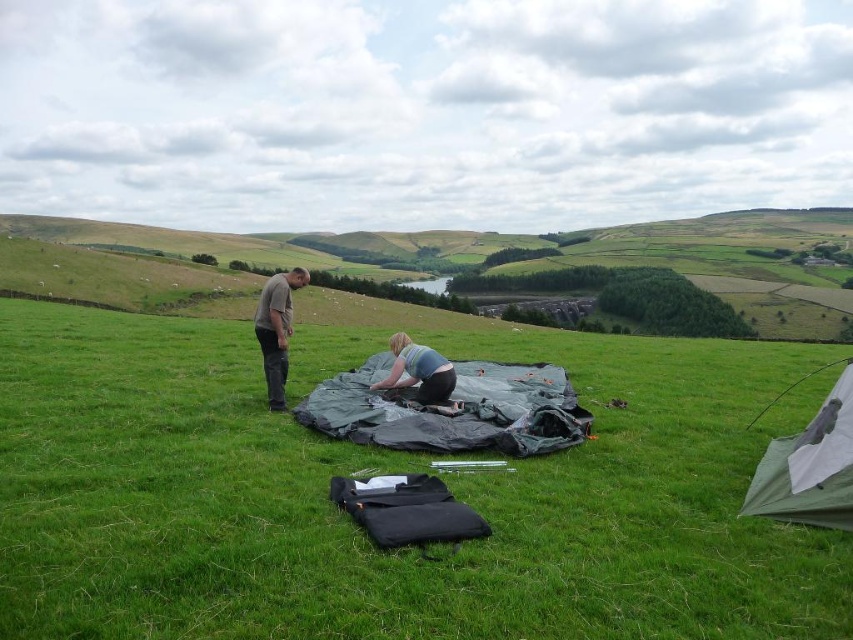
You are a hiker who needs to set up a tent. You have a tent that requires a minimum of 5 meters of space between the tent and the grassy area. Based on the scene, will the distance between the green grassy field at center and the light blue fabric at center be sufficient?

The distance between the green grassy field at center and the light blue fabric at center is 4.67 meters, which is less than the required 5 meters. Therefore, the space is insufficient for setting up the tent with the specified requirement.

You are planning to set up a picnic blanket in the green grassy field at center where the tent is located. Considering the height of the green fabric tent at center, will the tent block your view of the distant hills?

The green grassy field at center is much taller than the green fabric tent at center, so the tent will not block your view of the distant hills.